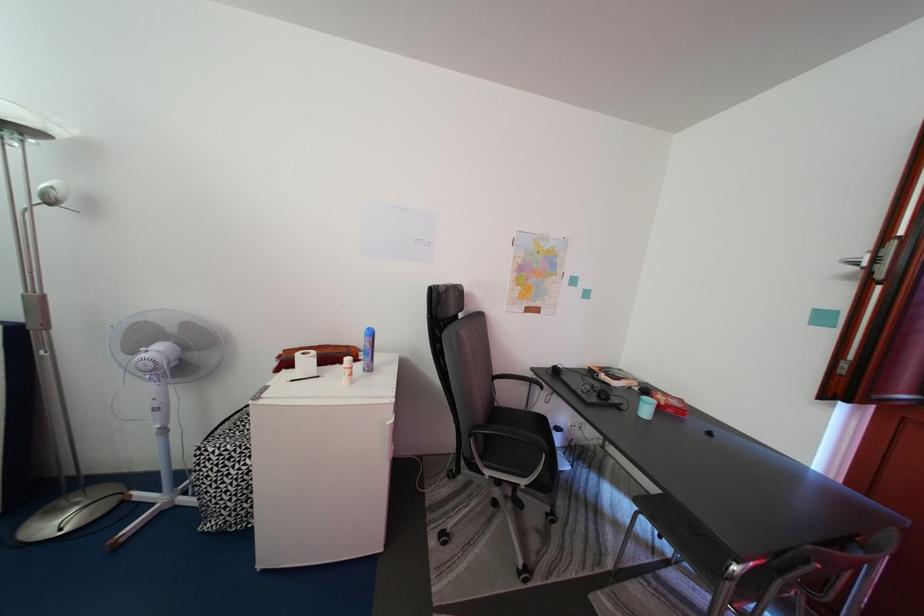
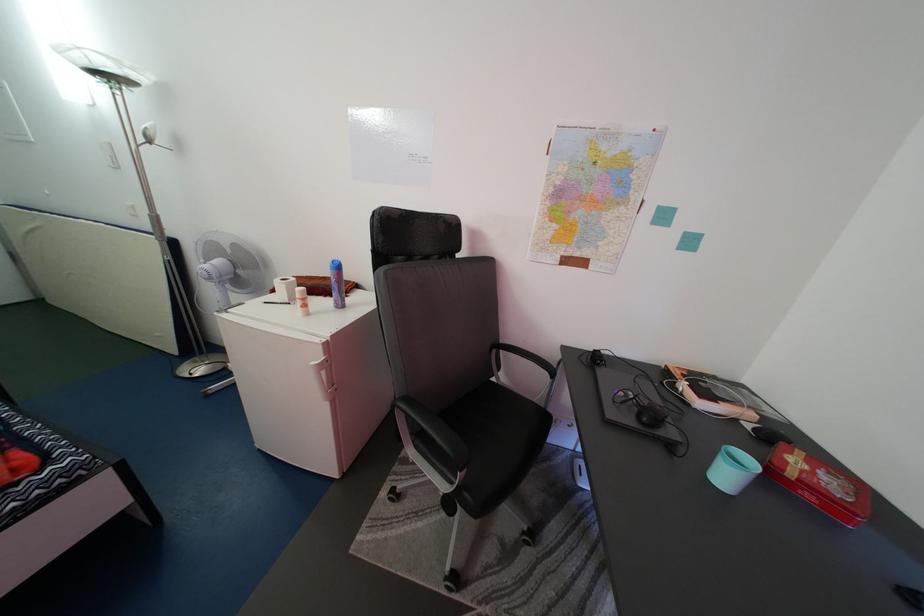
In the second image, find the point that corresponds to (x=195, y=331) in the first image.

(244, 253)